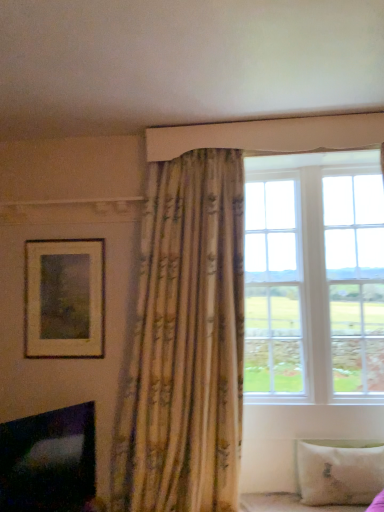
Question: Is matte gold picture frame at upper left further to camera compared to black glossy fireplace at lower left?

Choices:
 (A) yes
 (B) no

Answer: (A)

Question: Is matte gold picture frame at upper left far away from black glossy fireplace at lower left?

Choices:
 (A) yes
 (B) no

Answer: (B)

Question: Considering the relative positions of matte gold picture frame at upper left and black glossy fireplace at lower left in the image provided, is matte gold picture frame at upper left to the left of black glossy fireplace at lower left from the viewer's perspective?

Choices:
 (A) yes
 (B) no

Answer: (A)

Question: From a real-world perspective, is matte gold picture frame at upper left physically above black glossy fireplace at lower left?

Choices:
 (A) no
 (B) yes

Answer: (B)

Question: From a real-world perspective, is matte gold picture frame at upper left under black glossy fireplace at lower left?

Choices:
 (A) no
 (B) yes

Answer: (A)

Question: Is the depth of matte gold picture frame at upper left less than that of black glossy fireplace at lower left?

Choices:
 (A) yes
 (B) no

Answer: (B)

Question: Is white wood window at upper right aimed at matte gold picture frame at upper left?

Choices:
 (A) yes
 (B) no

Answer: (B)

Question: From a real-world perspective, is white wood window at upper right on top of matte gold picture frame at upper left?

Choices:
 (A) no
 (B) yes

Answer: (B)

Question: Is white wood window at upper right not close to matte gold picture frame at upper left?

Choices:
 (A) yes
 (B) no

Answer: (A)

Question: From the image's perspective, is white wood window at upper right below matte gold picture frame at upper left?

Choices:
 (A) yes
 (B) no

Answer: (B)

Question: Is white wood window at upper right bigger than matte gold picture frame at upper left?

Choices:
 (A) no
 (B) yes

Answer: (B)

Question: Is white wood window at upper right shorter than matte gold picture frame at upper left?

Choices:
 (A) yes
 (B) no

Answer: (B)

Question: Is white fabric bed frame at lower right with black glossy fireplace at lower left?

Choices:
 (A) no
 (B) yes

Answer: (A)